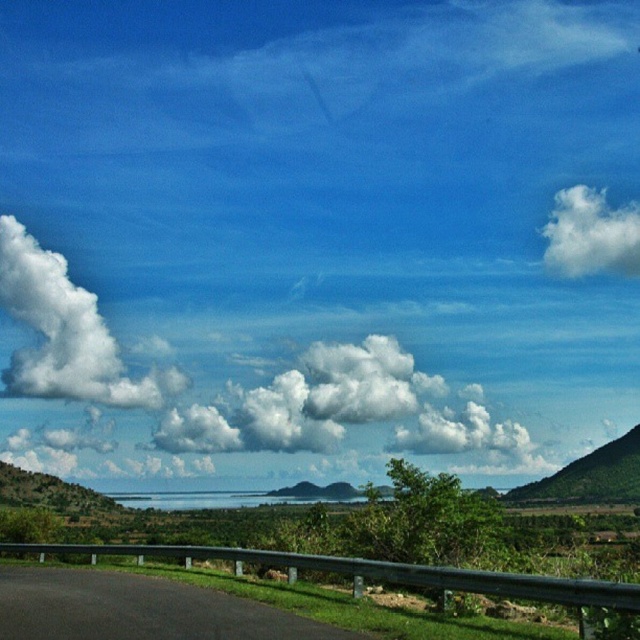
You are standing at the point marked by the coordinates point [230,390] in the image. Looking around, you see the vast blue sky above and the calm body of water below. Which object is directly above you in the scene?

The white fluffy cloud at upper center is directly above you at the coordinates point [230,390].

You are a pilot flying an airplane and need to navigate around the white fluffy cloud at upper center. What are the coordinates of the cloud to avoid collision?

The white fluffy cloud at upper center is located at coordinates point (230, 390).

You are driving along a scenic route and notice a white fluffy cloud at upper left and a green matte hill at right. Which object appears higher in the sky?

The white fluffy cloud at upper left appears higher in the sky than the green matte hill at right because it is located above it.